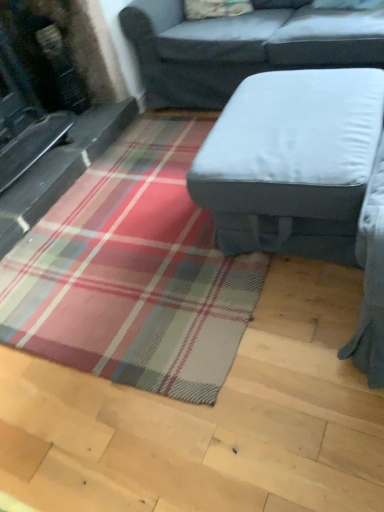
Question: Should I look upward or downward to see light gray fabric ottoman at center, which is the second studio couch from top to bottom?

Choices:
 (A) down
 (B) up

Answer: (B)

Question: Is light gray fabric ottoman at center, which is the second studio couch from top to bottom, positioned beyond the bounds of gray fabric studio couch at center, the 1th studio couch when ordered from top to bottom?

Choices:
 (A) yes
 (B) no

Answer: (A)

Question: Is light gray fabric ottoman at center, arranged as the first studio couch when ordered from the bottom, bigger than gray fabric studio couch at center, the 1th studio couch when ordered from top to bottom?

Choices:
 (A) yes
 (B) no

Answer: (B)

Question: Is light gray fabric ottoman at center, which is the second studio couch from top to bottom, closer to the viewer compared to gray fabric studio couch at center, the 1th studio couch when ordered from top to bottom?

Choices:
 (A) yes
 (B) no

Answer: (A)

Question: Does light gray fabric ottoman at center, arranged as the first studio couch when ordered from the bottom, have a greater width compared to gray fabric studio couch at center, the second studio couch from the bottom?

Choices:
 (A) yes
 (B) no

Answer: (B)

Question: Does light gray fabric ottoman at center, arranged as the first studio couch when ordered from the bottom, appear on the left side of gray fabric studio couch at center, the second studio couch from the bottom?

Choices:
 (A) no
 (B) yes

Answer: (B)

Question: From the image's perspective, is light gray fabric ottoman at center, which is the second studio couch from top to bottom, over gray fabric studio couch at center, the 1th studio couch when ordered from top to bottom?

Choices:
 (A) yes
 (B) no

Answer: (B)

Question: Does gray fabric studio couch at center, the second studio couch from the bottom, come behind light gray fabric ottoman at center, arranged as the first studio couch when ordered from the bottom?

Choices:
 (A) no
 (B) yes

Answer: (B)

Question: Can you confirm if gray fabric studio couch at center, the 1th studio couch when ordered from top to bottom, is positioned to the left of light gray fabric ottoman at center, which is the second studio couch from top to bottom?

Choices:
 (A) no
 (B) yes

Answer: (A)

Question: Considering the relative sizes of gray fabric studio couch at center, the second studio couch from the bottom, and light gray fabric ottoman at center, arranged as the first studio couch when ordered from the bottom, in the image provided, is gray fabric studio couch at center, the second studio couch from the bottom, shorter than light gray fabric ottoman at center, arranged as the first studio couch when ordered from the bottom,?

Choices:
 (A) no
 (B) yes

Answer: (A)

Question: Considering the relative sizes of gray fabric studio couch at center, the second studio couch from the bottom, and light gray fabric ottoman at center, arranged as the first studio couch when ordered from the bottom, in the image provided, is gray fabric studio couch at center, the second studio couch from the bottom, taller than light gray fabric ottoman at center, arranged as the first studio couch when ordered from the bottom,?

Choices:
 (A) yes
 (B) no

Answer: (A)

Question: Can you confirm if gray fabric studio couch at center, the 1th studio couch when ordered from top to bottom, is bigger than light gray fabric ottoman at center, which is the second studio couch from top to bottom?

Choices:
 (A) no
 (B) yes

Answer: (B)

Question: From a real-world perspective, does gray fabric studio couch at center, the 1th studio couch when ordered from top to bottom, stand above light gray fabric ottoman at center, which is the second studio couch from top to bottom?

Choices:
 (A) yes
 (B) no

Answer: (A)

Question: In terms of width, does gray fabric studio couch at center, the second studio couch from the bottom, look wider or thinner when compared to light gray fabric ottoman at center, which is the second studio couch from top to bottom?

Choices:
 (A) thin
 (B) wide

Answer: (B)